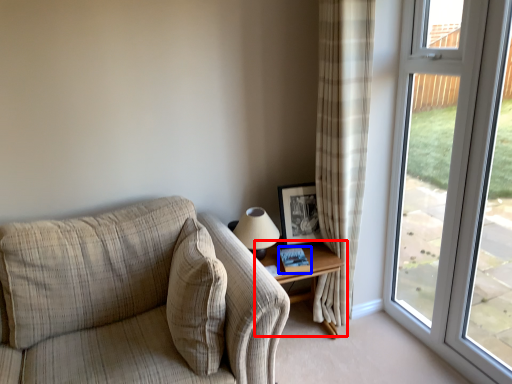
Question: Which object appears farthest to the camera in this image, table (highlighted by a red box) or book (highlighted by a blue box)?

Choices:
 (A) table
 (B) book

Answer: (B)